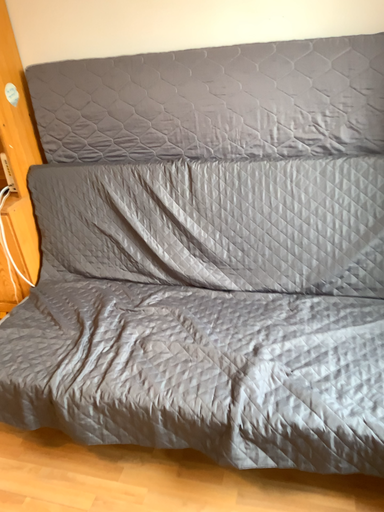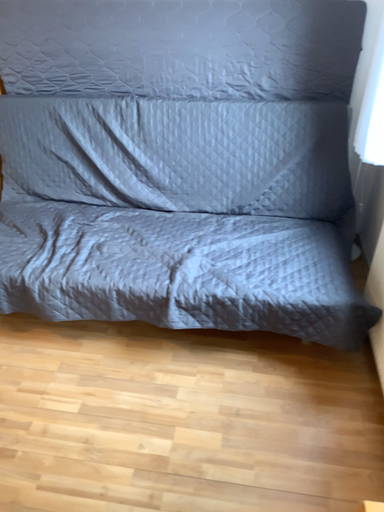
Question: How did the camera likely rotate when shooting the video?

Choices:
 (A) rotated left
 (B) rotated right

Answer: (B)